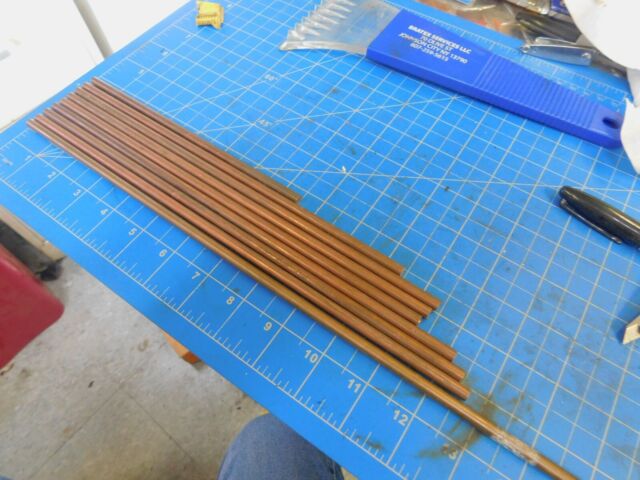
Identify the location of marker cap. This screenshot has width=640, height=480. (589, 210).